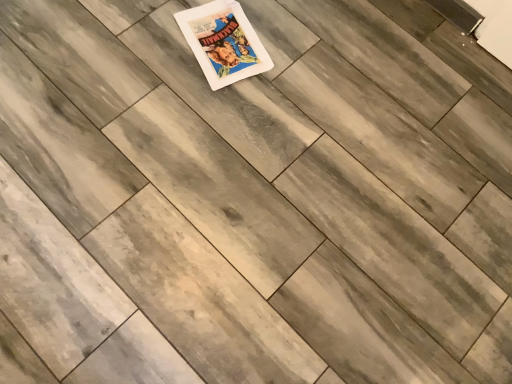
Find the location of a particular element. The width and height of the screenshot is (512, 384). vacant region in front of matte white comic book at upper center is located at coordinates (203, 117).